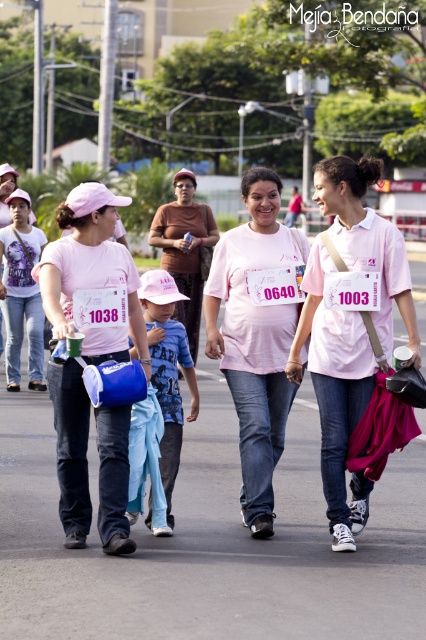
Question: Is pink matte t-shirt at center below brown matte shirt at center?

Choices:
 (A) no
 (B) yes

Answer: (B)

Question: Which point is farther from the camera taking this photo?

Choices:
 (A) (203, 240)
 (B) (275, 332)

Answer: (A)

Question: Is pink matte t-shirt at center below blue denim jeans at center?

Choices:
 (A) yes
 (B) no

Answer: (B)

Question: Which point appears closest to the camera in this image?

Choices:
 (A) (294, 312)
 (B) (123, 512)
 (C) (198, 232)
 (D) (169, 288)

Answer: (B)

Question: Is pink matte t-shirt at center above brown matte shirt at center?

Choices:
 (A) yes
 (B) no

Answer: (B)

Question: Which point is farther from the camera taking this photo?

Choices:
 (A) (233, 253)
 (B) (86, 296)
 (C) (180, 253)

Answer: (C)